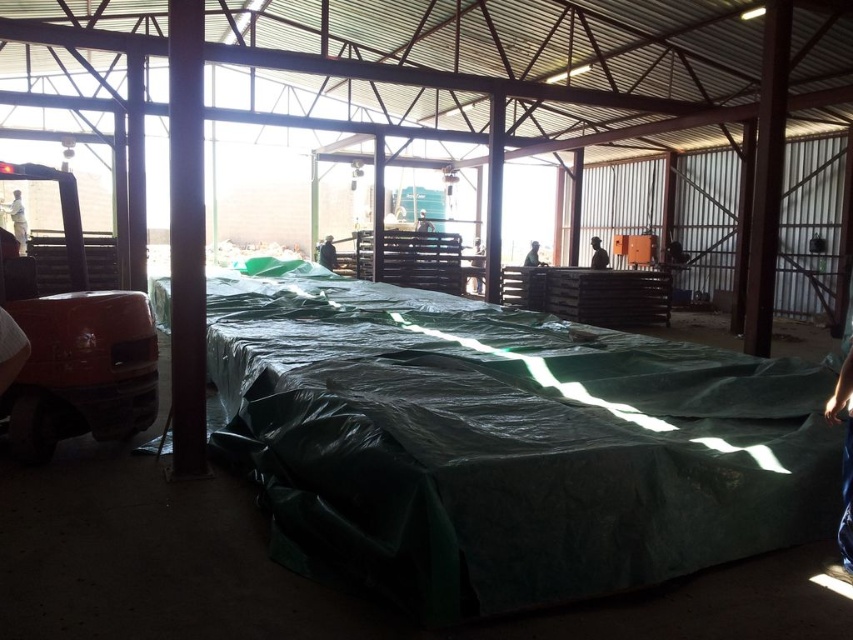
You are a warehouse inspector checking the storage area. You see the green tarp at center and the black fabric worker at center. Based on their positions, which one is covering a larger area?

The green tarp at center might be wider than black fabric worker at center, so it is likely covering a larger area.

You are standing at the entrance of the warehouse and see the point marked at coordinate (598, 253). What object is located at that point?

The black fabric worker at center is located at point (598, 253).